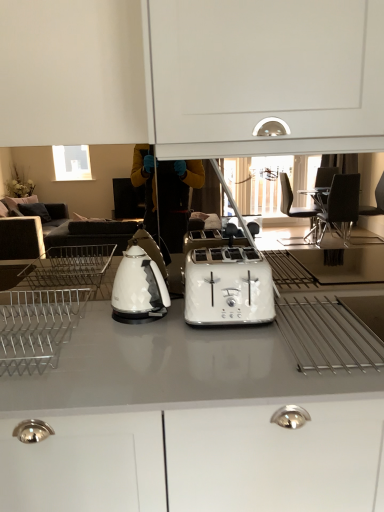
At what (x,y) coordinates should I click in order to perform the action: click on unoccupied area in front of white glossy toaster at center. Please return your answer as a coordinate pair (x, y). The width and height of the screenshot is (384, 512). Looking at the image, I should click on (217, 351).